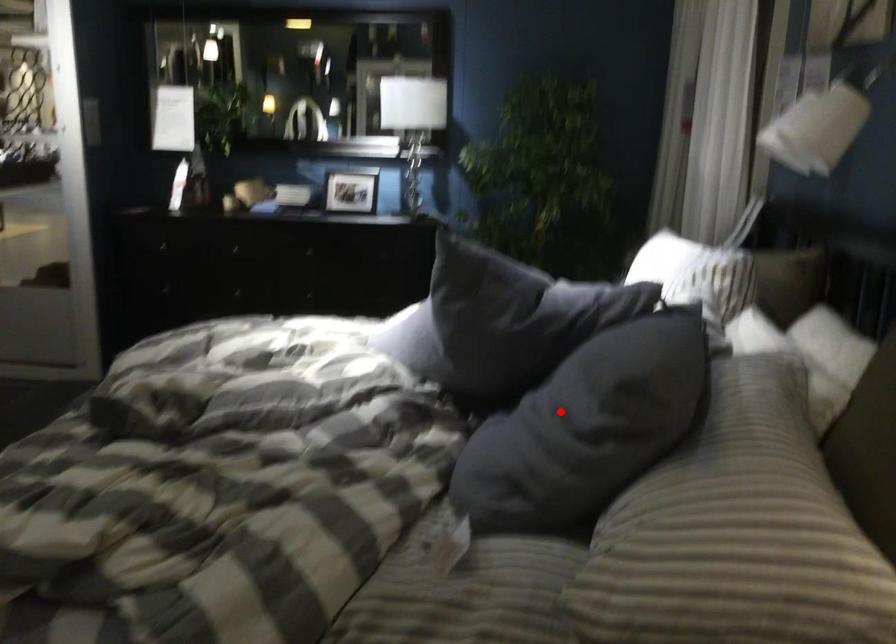
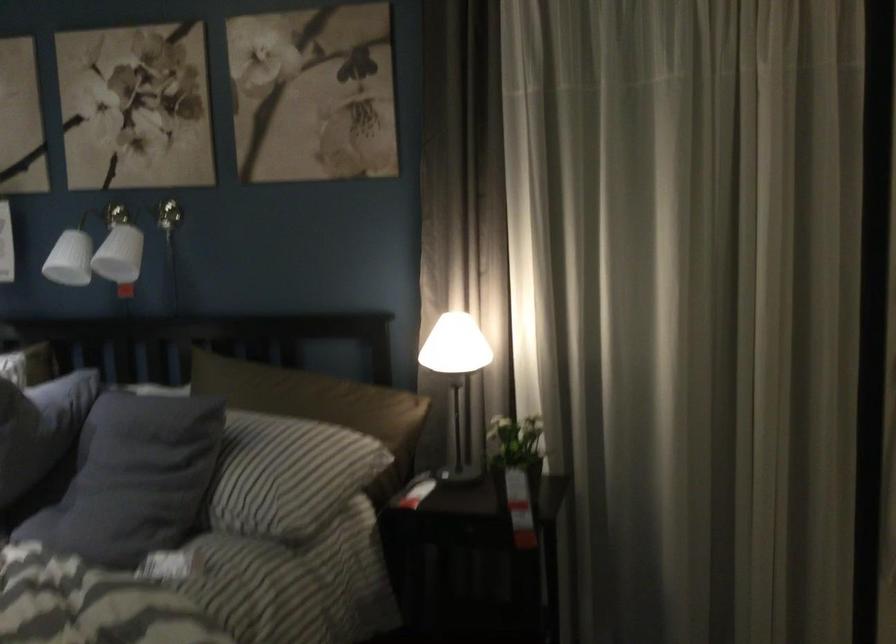
Question: I am providing you with two images of the same scene from different viewpoints. A red point is shown in image1. For the corresponding object point in image2, is it positioned nearer or farther from the camera?

Choices:
 (A) Nearer
 (B) Farther

Answer: (B)